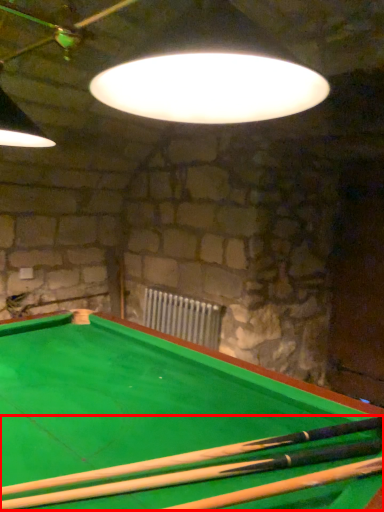
Question: Where is cue (annotated by the red box) located in relation to radiator in the image?

Choices:
 (A) right
 (B) left

Answer: (A)